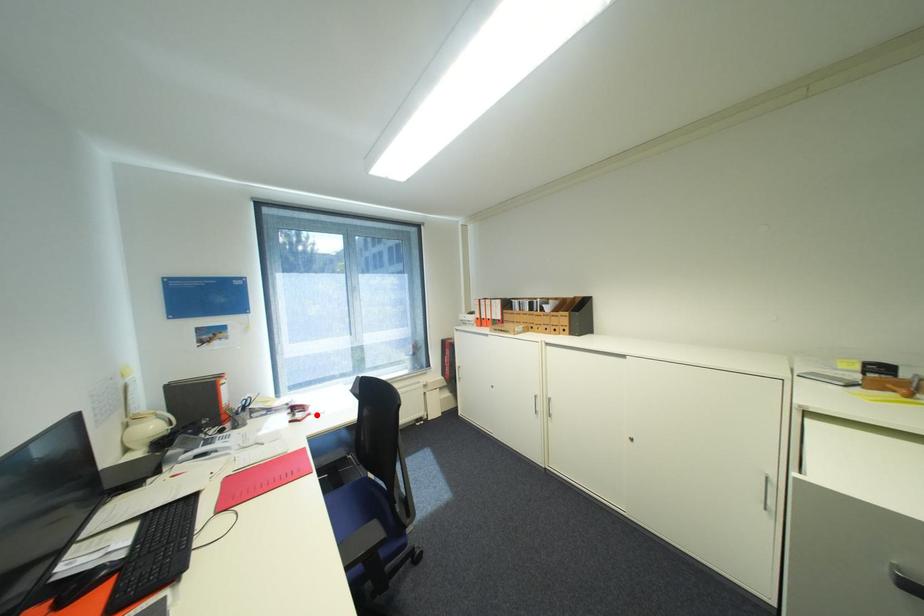
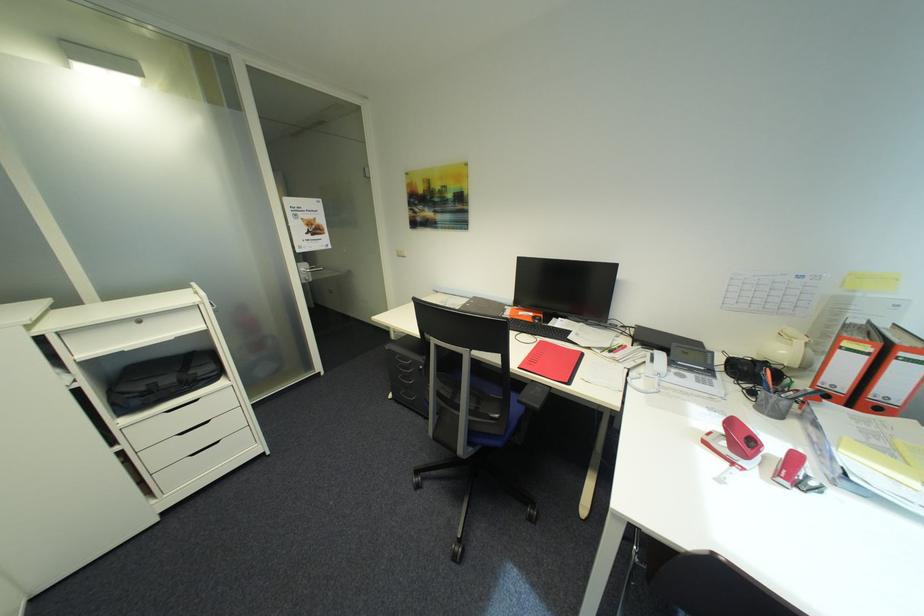
In the second image, find the point that corresponds to the highlighted location in the first image.

(742, 464)